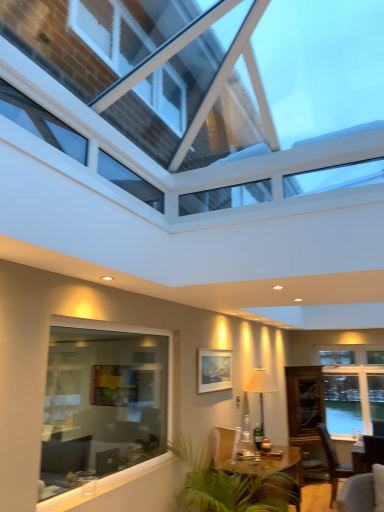
Question: Does matte white lamp at center have a greater width compared to transparent glass cabinet at right?

Choices:
 (A) no
 (B) yes

Answer: (A)

Question: Is transparent glass cabinet at right inside matte white lamp at center?

Choices:
 (A) no
 (B) yes

Answer: (A)

Question: Does matte white lamp at center have a lesser width compared to transparent glass cabinet at right?

Choices:
 (A) no
 (B) yes

Answer: (B)

Question: From the image's perspective, does matte white lamp at center appear lower than transparent glass cabinet at right?

Choices:
 (A) no
 (B) yes

Answer: (A)

Question: From a real-world perspective, is matte white lamp at center positioned over transparent glass cabinet at right based on gravity?

Choices:
 (A) no
 (B) yes

Answer: (B)

Question: Is point (206, 136) closer or farther from the camera than point (350, 425)?

Choices:
 (A) farther
 (B) closer

Answer: (B)

Question: In terms of width, does transparent glass roof at upper center, the 3th window from the back, look wider or thinner when compared to white glass window at right, the first window in the back-to-front sequence?

Choices:
 (A) thin
 (B) wide

Answer: (B)

Question: From a real-world perspective, is transparent glass roof at upper center, the 1th window when ordered from front to back, positioned above or below white glass window at right, the first window in the back-to-front sequence?

Choices:
 (A) above
 (B) below

Answer: (A)

Question: Would you say transparent glass roof at upper center, the 1th window when ordered from front to back, is inside or outside white glass window at right, which is the 3th window in front-to-back order?

Choices:
 (A) inside
 (B) outside

Answer: (B)

Question: Is transparent glass cabinet at right inside the boundaries of clear glass window at lower left, which is the 2th window in back-to-front order, or outside?

Choices:
 (A) outside
 (B) inside

Answer: (A)

Question: In the image, is transparent glass cabinet at right on the left side or the right side of clear glass window at lower left, which is the second window in front-to-back order?

Choices:
 (A) left
 (B) right

Answer: (B)

Question: Considering the positions of transparent glass cabinet at right and clear glass window at lower left, which is the second window in front-to-back order, in the image, is transparent glass cabinet at right wider or thinner than clear glass window at lower left, which is the second window in front-to-back order,?

Choices:
 (A) wide
 (B) thin

Answer: (A)

Question: Relative to clear glass window at lower left, which is the second window in front-to-back order, is transparent glass cabinet at right in front or behind?

Choices:
 (A) behind
 (B) front

Answer: (A)

Question: Considering the positions of brown wooden chair at lower right and transparent glass roof at upper center, the 3th window from the back, in the image, is brown wooden chair at lower right taller or shorter than transparent glass roof at upper center, the 3th window from the back,?

Choices:
 (A) short
 (B) tall

Answer: (B)

Question: Considering the relative positions of brown wooden chair at lower right and transparent glass roof at upper center, the 3th window from the back, in the image provided, is brown wooden chair at lower right to the left or to the right of transparent glass roof at upper center, the 3th window from the back,?

Choices:
 (A) left
 (B) right

Answer: (B)